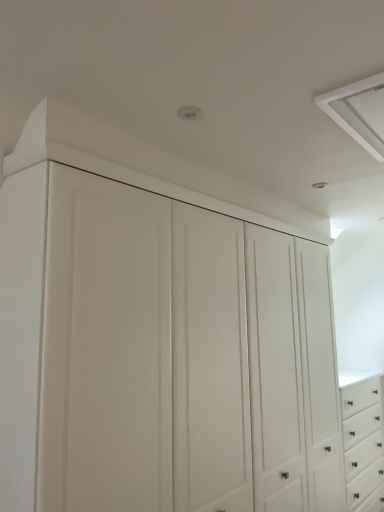
In order to face white matte cabinet at center, should I rotate leftwards or rightwards?

Rotate right and turn 1.760 degrees.

I want to click on white matte cabinet at center, so 158,345.

The image size is (384, 512). Describe the element at coordinates (158, 345) in the screenshot. I see `white matte cabinet at center` at that location.

The image size is (384, 512). I want to click on white matte cabinet at center, so click(x=158, y=345).